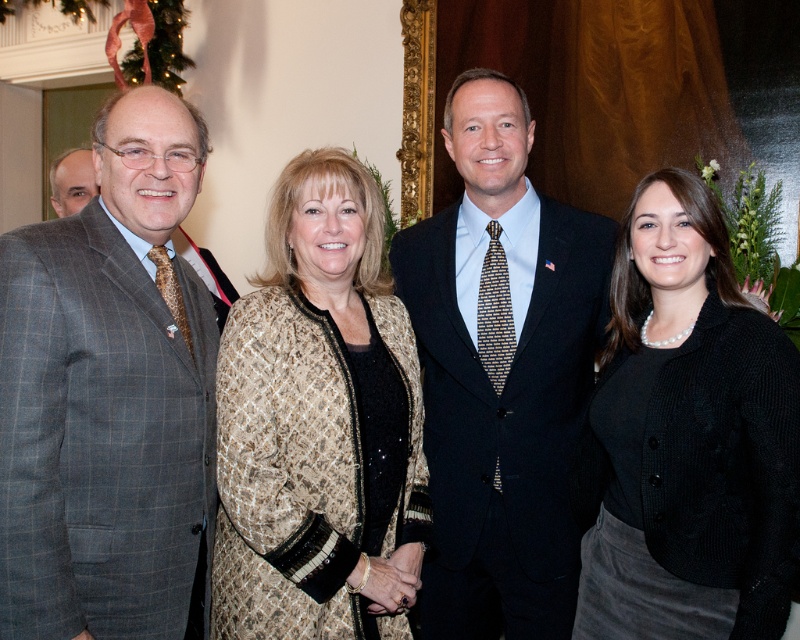
You are standing in the room and want to hand a document to the person in the gray checkered suit at left. Based on their position, which direction should you walk to reach them?

The gray checkered suit at left is located at point (102,417), so you should walk towards the left side of the room to reach them.